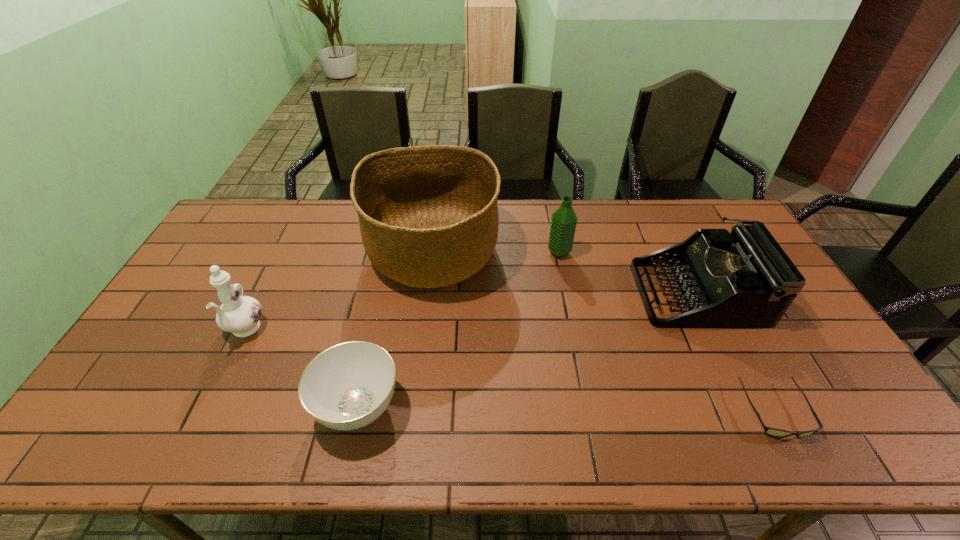
Identify the location of basket. Image resolution: width=960 pixels, height=540 pixels. (428, 215).

This screenshot has height=540, width=960. I want to click on the left chinaware, so click(x=238, y=314).

Where is `the leftmost object`? the leftmost object is located at coordinates (238, 314).

Where is `water bottle`? water bottle is located at coordinates (563, 222).

You are a GUI agent. You are given a task and a screenshot of the screen. Output one action in this format:
    pyautogui.click(x=<x>, y=<y>)
    Task: Click on the fourth tallest object
    Image resolution: width=960 pixels, height=540 pixels.
    Given the screenshot: What is the action you would take?
    pyautogui.click(x=743, y=279)

The height and width of the screenshot is (540, 960). Find the location of `the fifth tallest object`. the fifth tallest object is located at coordinates (348, 386).

The image size is (960, 540). What are the coordinates of `the shorter chinaware` in the screenshot? It's located at (348, 386).

Find the location of `sunglasses`. sunglasses is located at coordinates (774, 432).

Locate an element on the screen. vacant region located on the front of the basket is located at coordinates pos(422,340).

This screenshot has width=960, height=540. In order to click on blank space located at the spout of the leftmost object in this screenshot , I will do `click(209, 402)`.